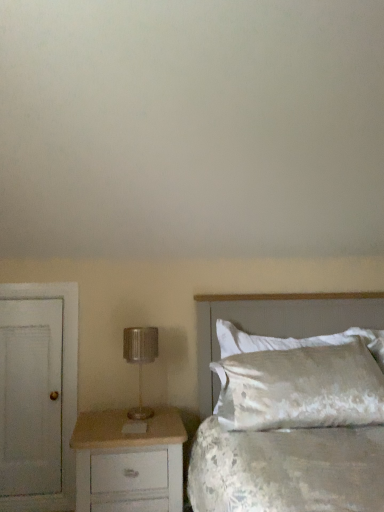
Image resolution: width=384 pixels, height=512 pixels. In order to click on free point below metallic silver lamp at left (from a real-world perspective) in this screenshot , I will do `click(152, 412)`.